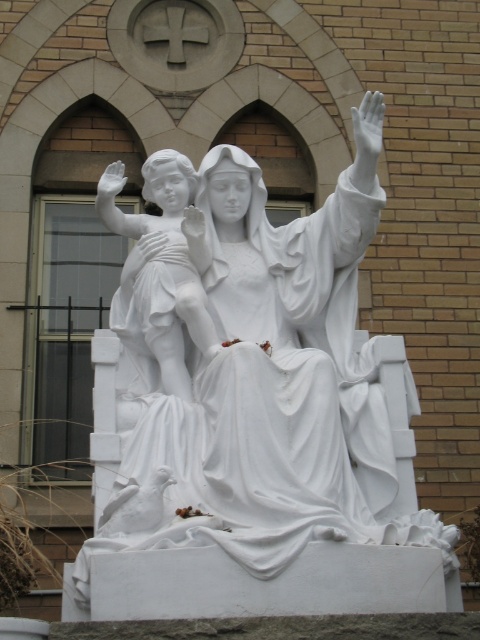
You are a sculptor who needs to place a new decorative element between the white marble cherub at center and the white marble hand at upper center. Given that the decorative element requires 10 feet of space, will there be enough room?

The distance between the white marble cherub at center and the white marble hand at upper center is 12.14 feet, which is more than enough to accommodate the decorative element requiring 10 feet of space.

You are an art conservator assessing the spacing between the white marble statue at center and the white marble hand at upper center. The minimum recommended distance for preservation purposes is 25 feet. Is the current spacing sufficient?

The distance between the white marble statue at center and the white marble hand at upper center is 30.32 feet, which exceeds the minimum recommended 25 feet. Therefore, the current spacing is sufficient for preservation purposes.

You are an art conservator examining the statue. You notice the white marble cherub at center and the white marble hand at upper center. Based on their positions, which one is closer to you?

The white marble cherub at center is closer to you because it is positioned in front of the white marble hand at upper center.